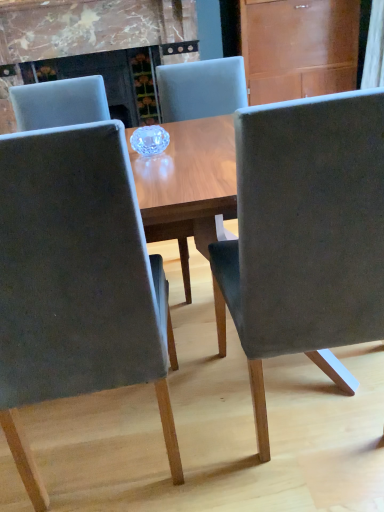
Locate an element on the screen. vacant space underneath velvet gray chair at center, the first chair from the left (from a real-world perspective) is located at coordinates click(x=107, y=442).